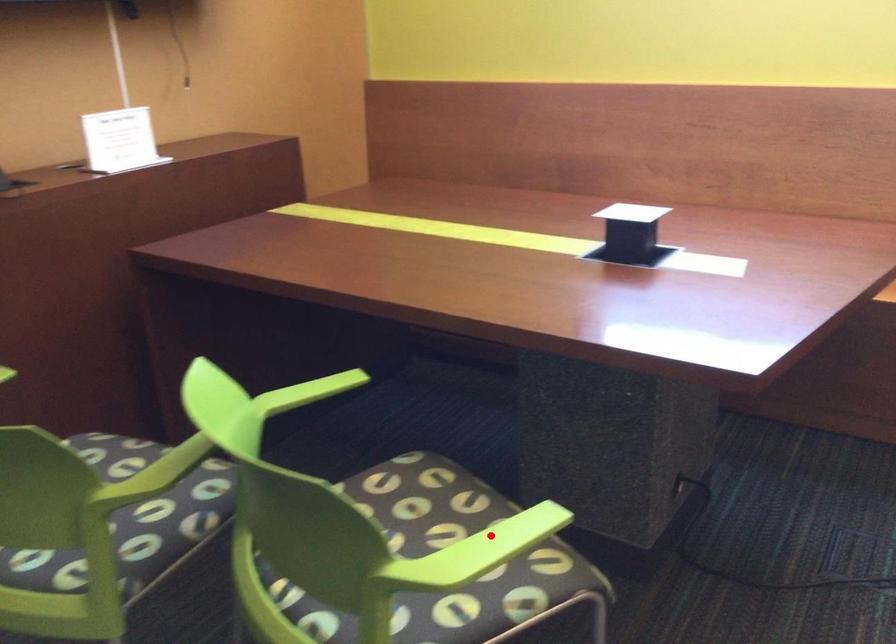
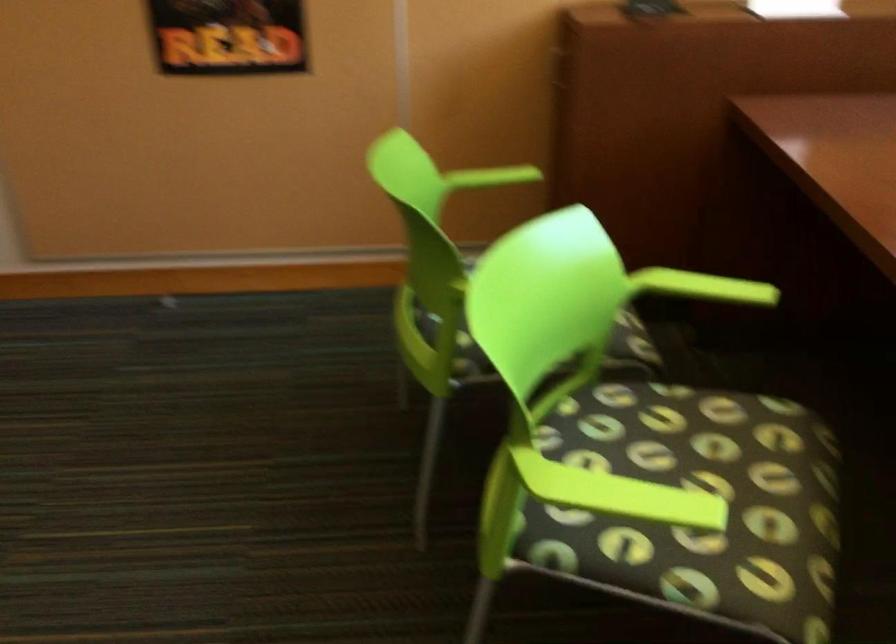
Question: I am providing you with two images of the same scene from different viewpoints. A red point is shown in image1. For the corresponding object point in image2, is it positioned nearer or farther from the camera?

Choices:
 (A) Nearer
 (B) Farther

Answer: (A)